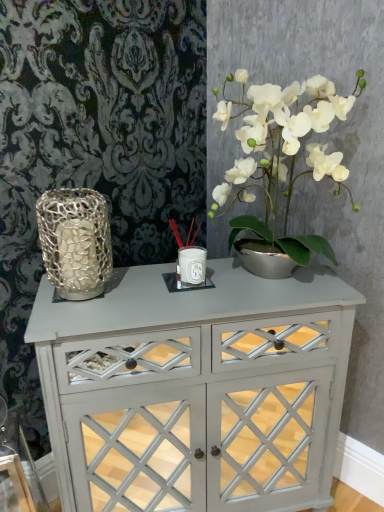
The height and width of the screenshot is (512, 384). What do you see at coordinates (196, 389) in the screenshot?
I see `white painted wood cabinet at center` at bounding box center [196, 389].

At what (x,y) coordinates should I click in order to perform the action: click on white painted wood cabinet at center. Please return your answer as a coordinate pair (x, y). This screenshot has width=384, height=512. Looking at the image, I should click on (196, 389).

What are the coordinates of `white painted wood cabinet at center` in the screenshot? It's located at (196, 389).